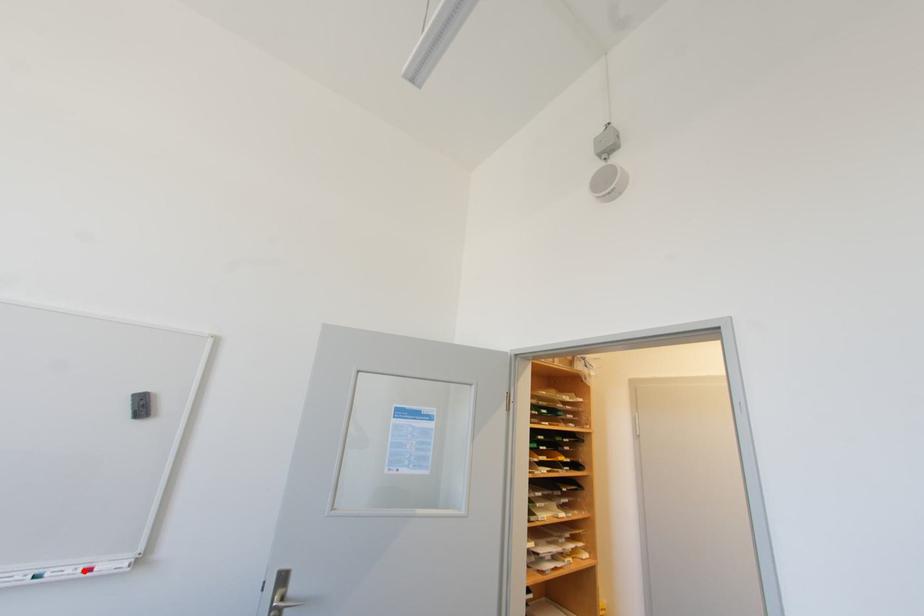
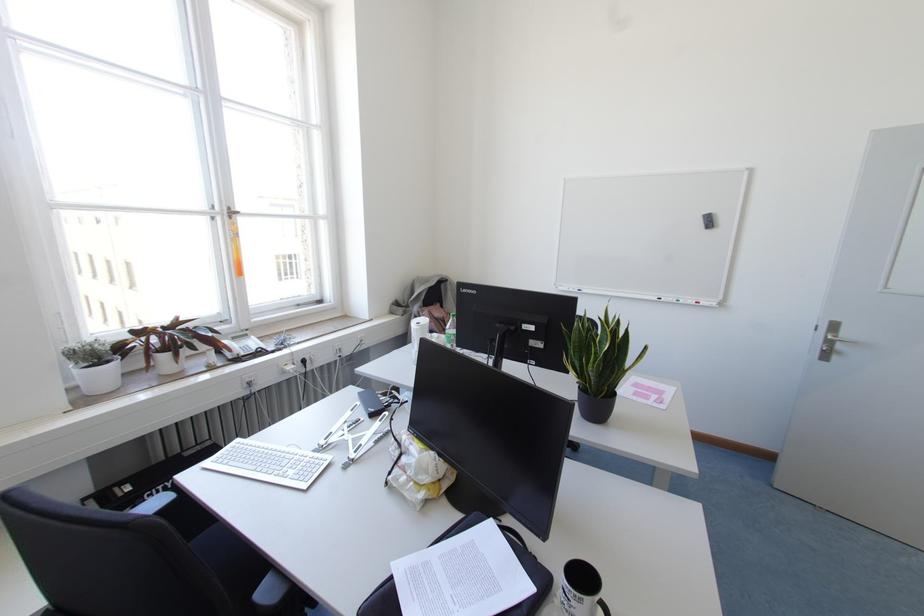
In the second image, find the point that corresponds to the highlighted location in the first image.

(696, 302)